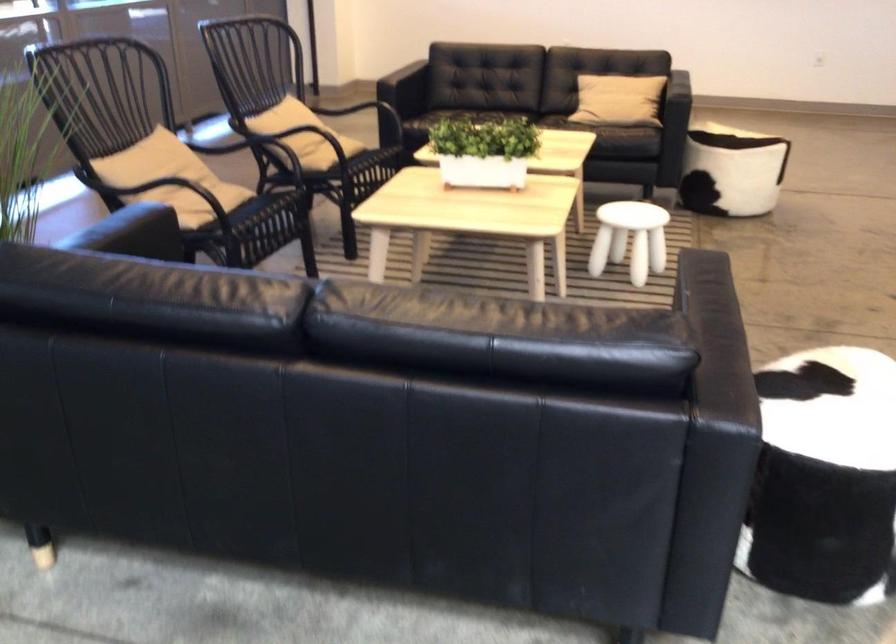
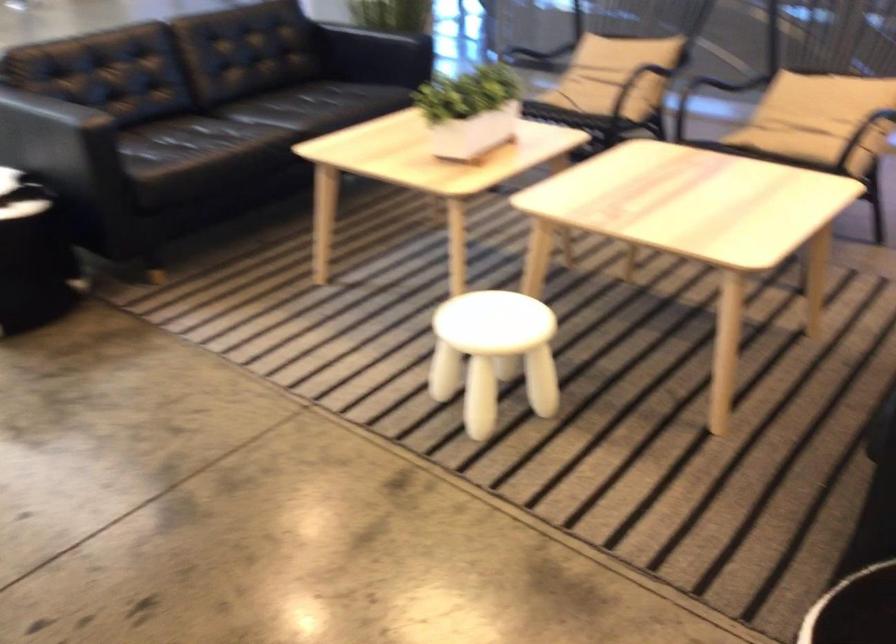
Where in the second image is the point corresponding to point (501, 144) from the first image?

(470, 111)